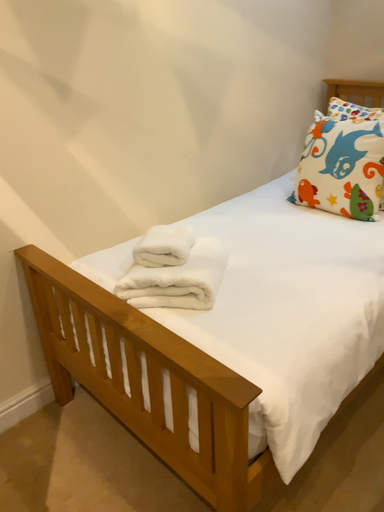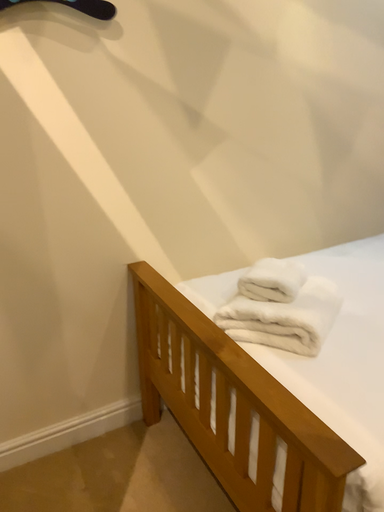
Question: Which way did the camera rotate in the video?

Choices:
 (A) rotated left
 (B) rotated right

Answer: (A)